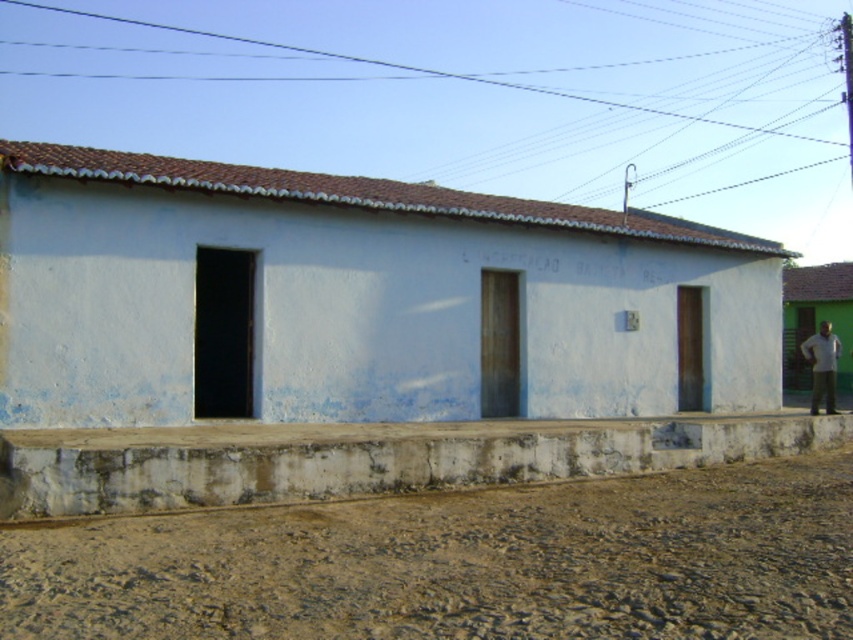
Can you confirm if white matte building at center is positioned to the right of brown gravel at lower center?

Incorrect, white matte building at center is not on the right side of brown gravel at lower center.

Who is positioned more to the left, white matte building at center or brown gravel at lower center?

From the viewer's perspective, white matte building at center appears more on the left side.

Which is behind, point (677, 323) or point (791, 637)?

Positioned behind is point (677, 323).

This screenshot has width=853, height=640. Find the location of `white matte building at center`. white matte building at center is located at coordinates (358, 300).

The width and height of the screenshot is (853, 640). I want to click on brown gravel at lower center, so click(460, 563).

Does brown gravel at lower center have a greater width compared to white cotton shirt at right?

Indeed, brown gravel at lower center has a greater width compared to white cotton shirt at right.

Between point (200, 614) and point (819, 387), which one is positioned behind?

The point (819, 387) is behind.

Find the location of `brown gravel at lower center`. brown gravel at lower center is located at coordinates (460, 563).

Who is shorter, white matte building at center or white concrete ledge at lower center?

white concrete ledge at lower center is shorter.

Is point (738, 284) closer to viewer compared to point (782, 429)?

No, (738, 284) is further to viewer.

Does point (57, 282) come closer to viewer compared to point (318, 484)?

No.

Where is `white matte building at center`? white matte building at center is located at coordinates (358, 300).